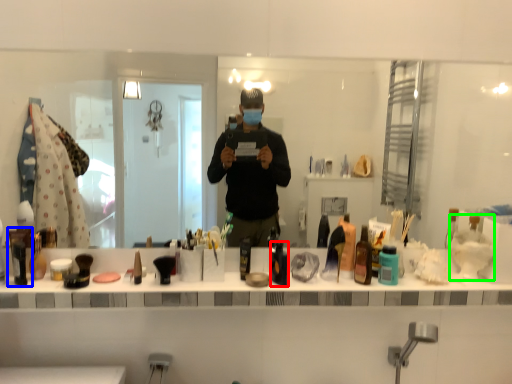
Question: Which object is positioned closest to toiletry (highlighted by a red box)? Select from toiletry (highlighted by a blue box) and shaving cream (highlighted by a green box).

Choices:
 (A) toiletry
 (B) shaving cream

Answer: (B)